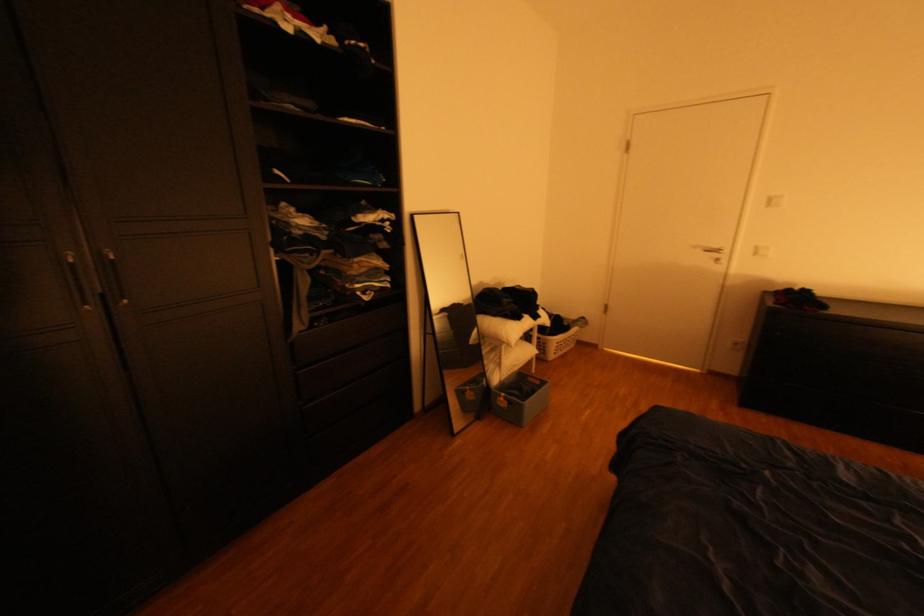
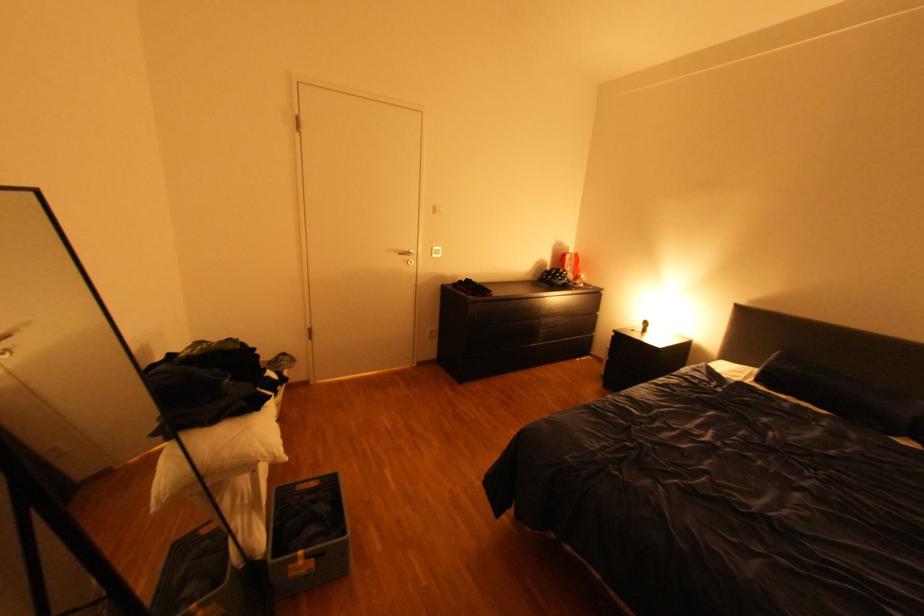
In the second image, find the point that corresponds to the point at 702,246 in the first image.

(399, 249)